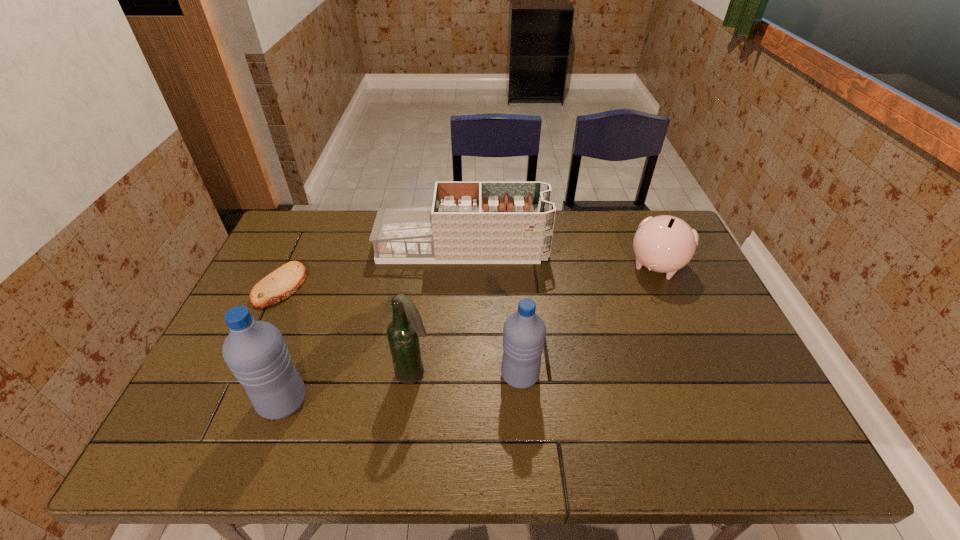
Locate an element on the screen. This screenshot has width=960, height=540. free space located on the right of the leftmost object is located at coordinates (324, 286).

Identify the location of vacant space located 0.390m at the entrance of the dollhouse. The image size is (960, 540). (667, 247).

At what (x,y) coordinates should I click in order to perform the action: click on free space located on the left of the rightmost object. Please return your answer as a coordinate pair (x, y). This screenshot has height=540, width=960. Looking at the image, I should click on (580, 266).

Where is `vacant position located 0.090m on the back of the beer bottle`? The image size is (960, 540). vacant position located 0.090m on the back of the beer bottle is located at coordinates (420, 334).

Image resolution: width=960 pixels, height=540 pixels. In order to click on dollhouse present at the far edge in this screenshot , I will do `click(468, 222)`.

This screenshot has width=960, height=540. What are the coordinates of `piggy bank located at the far edge` in the screenshot? It's located at (665, 244).

Identify the location of beer bottle at the near edge. (403, 333).

Where is `water bottle present at the left edge`? water bottle present at the left edge is located at coordinates (255, 351).

I want to click on pita bread located at the left edge, so click(280, 284).

Locate an element on the screen. object that is at the right edge is located at coordinates (665, 244).